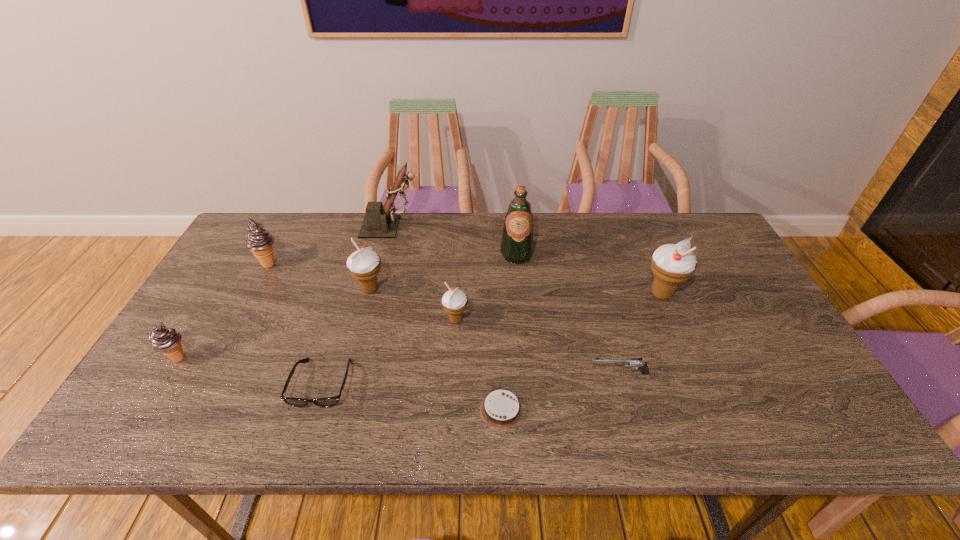
The image size is (960, 540). In the image, there is a desktop. What are the coordinates of `free space at the near right corner` in the screenshot? It's located at (768, 415).

The height and width of the screenshot is (540, 960). What are the coordinates of `free space between the green olive oil and the rightmost object` in the screenshot? It's located at [588, 274].

Locate an element on the screen. empty space that is in between the chocolate cake and the green olive oil is located at coordinates (509, 332).

At what (x,y) coordinates should I click in order to perform the action: click on free area in between the olive oil and the farther chocolate icecream. Please return your answer as a coordinate pair (x, y). Looking at the image, I should click on (393, 259).

Image resolution: width=960 pixels, height=540 pixels. I want to click on free space between the silver pistol and the chocolate cake, so click(560, 392).

This screenshot has width=960, height=540. I want to click on vacant region between the spectacles and the brown figurine, so click(357, 306).

Locate an element on the screen. The image size is (960, 540). vacant space that is in between the fourth icecream from right to left and the figurine is located at coordinates (330, 245).

I want to click on free space between the right chocolate icecream and the second shortest object, so click(296, 324).

Find the location of a particular element. The image size is (960, 540). empty location between the olive oil and the third tallest object is located at coordinates (588, 274).

In order to click on free space between the smaller chocolate icecream and the farthest icecream in this screenshot , I will do `click(224, 311)`.